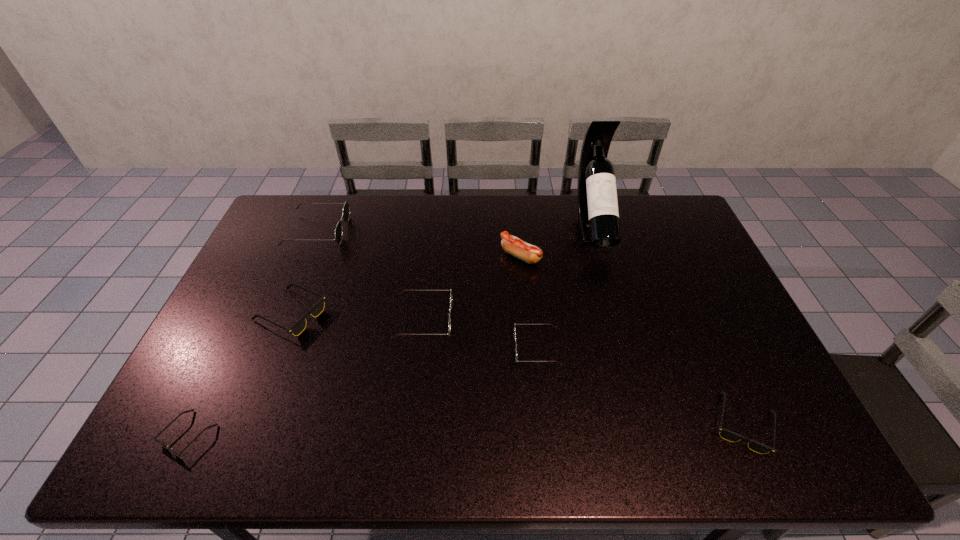
Where is `the tallest object`? the tallest object is located at coordinates tap(598, 216).

At what (x,y) coordinates should I click in order to perform the action: click on wine bottle. Please return your answer as a coordinate pair (x, y). This screenshot has width=960, height=540. Looking at the image, I should click on (598, 216).

I want to click on the leftmost green sunglasses, so click(x=346, y=209).

Identify the location of the biggest green sunglasses. The height and width of the screenshot is (540, 960). (346, 209).

The height and width of the screenshot is (540, 960). I want to click on sausage, so click(x=531, y=254).

Locate an element on the screen. This screenshot has height=540, width=960. the second tallest sunglasses is located at coordinates click(449, 327).

Find the location of a particular element. the fourth tallest object is located at coordinates (449, 327).

This screenshot has height=540, width=960. Find the location of `the farthest black sunglasses`. the farthest black sunglasses is located at coordinates (299, 326).

The height and width of the screenshot is (540, 960). In order to click on the smallest green sunglasses in this screenshot , I will do `click(514, 323)`.

The height and width of the screenshot is (540, 960). Find the location of `the fifth sunglasses from left to right`. the fifth sunglasses from left to right is located at coordinates pyautogui.click(x=514, y=323).